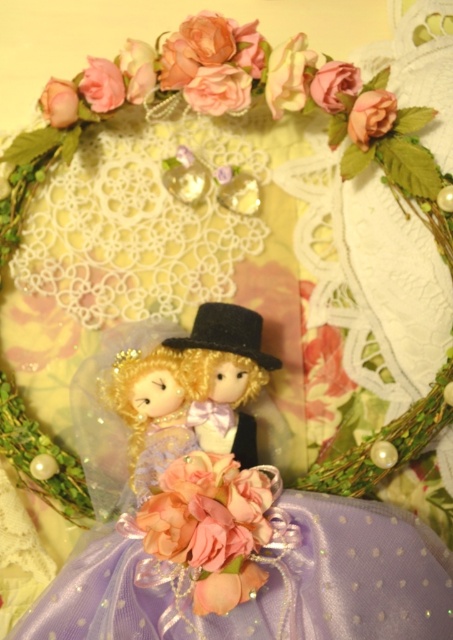
Question: Estimate the real-world distances between objects in this image. Which object is farther from the matte purple fabric doll at center?

Choices:
 (A) matte pink rose at upper left
 (B) satin black top hat at center

Answer: (A)

Question: Which object is positioned farthest from the pink satin rose at upper center?

Choices:
 (A) lavender satin dress at center
 (B) pink satin flower at center
 (C) matte pink rose at upper center
 (D) matte pink rose at upper left

Answer: (A)

Question: Observing the image, what is the correct spatial positioning of matte purple fabric doll at center in reference to matte pink rose at upper center?

Choices:
 (A) below
 (B) above

Answer: (A)

Question: Does lavender satin dress at center come behind matte purple fabric doll at center?

Choices:
 (A) yes
 (B) no

Answer: (B)

Question: Is lavender satin dress at center above pink satin flower at center?

Choices:
 (A) yes
 (B) no

Answer: (B)

Question: Which is farther from the matte pink rose at upper center?

Choices:
 (A) matte pink rose at upper left
 (B) pink satin rose at upper center

Answer: (A)